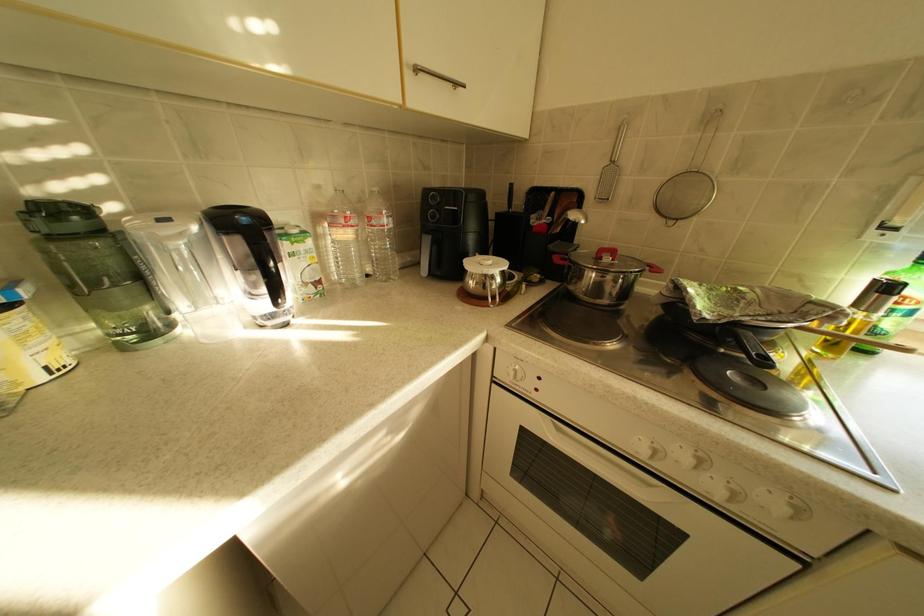
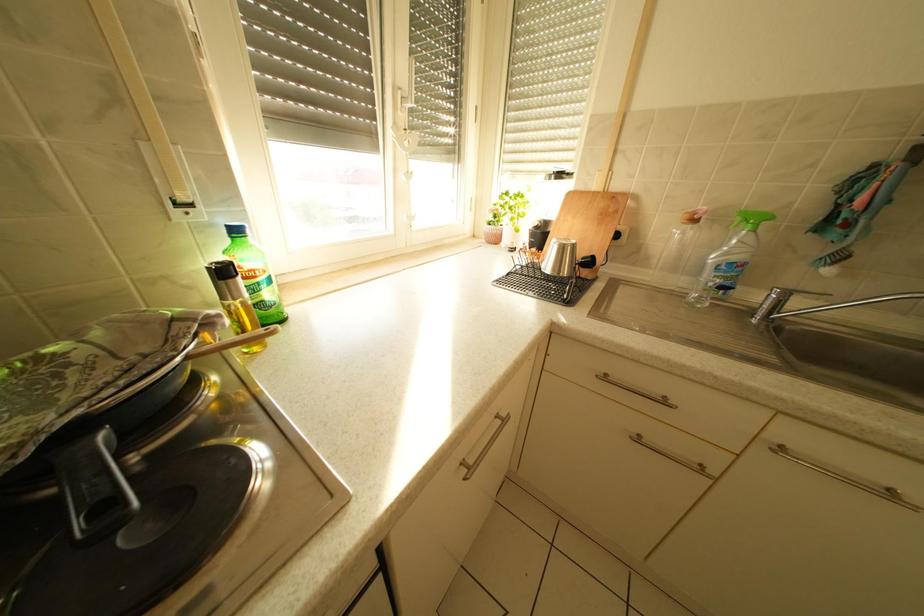
Based on the continuous images, in which direction is the camera rotating?

The camera's rotation is toward right-down.